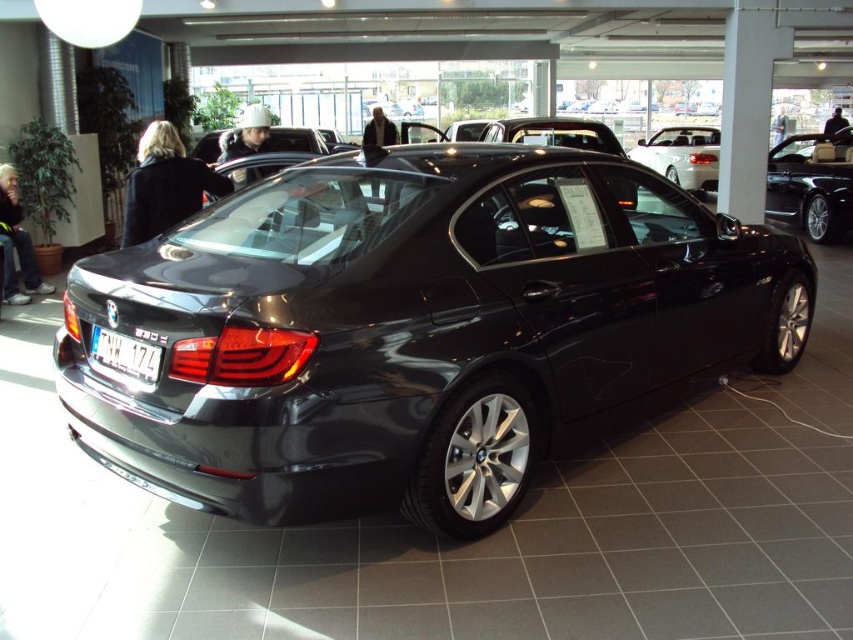
You are a customer in a car showroom and want to locate the white plastic license plate at rear of the satin silver sedan at center. Based on the scene description, where should you look relative to the sedan?

The satin silver sedan at center is to the right of the white plastic license plate at rear, so the license plate is located to the left of the sedan.

In the scene shown: You are a delivery person who needs to park a 2.5 meter wide delivery van between the glossy metallic car at center and the satin silver sedan at center in the car showroom. Is there enough space between them for the van?

The glossy metallic car at center and the satin silver sedan at center are 10.78 meters apart. Since the delivery van is only 2.5 meters wide, there is more than enough space between them to park the van.

You are a customer in a car showroom looking at two cars. You see the glossy metallic car at center and the satin silver sedan at center. Which car is positioned to the left?

The glossy metallic car at center is positioned to the left of the satin silver sedan at center.